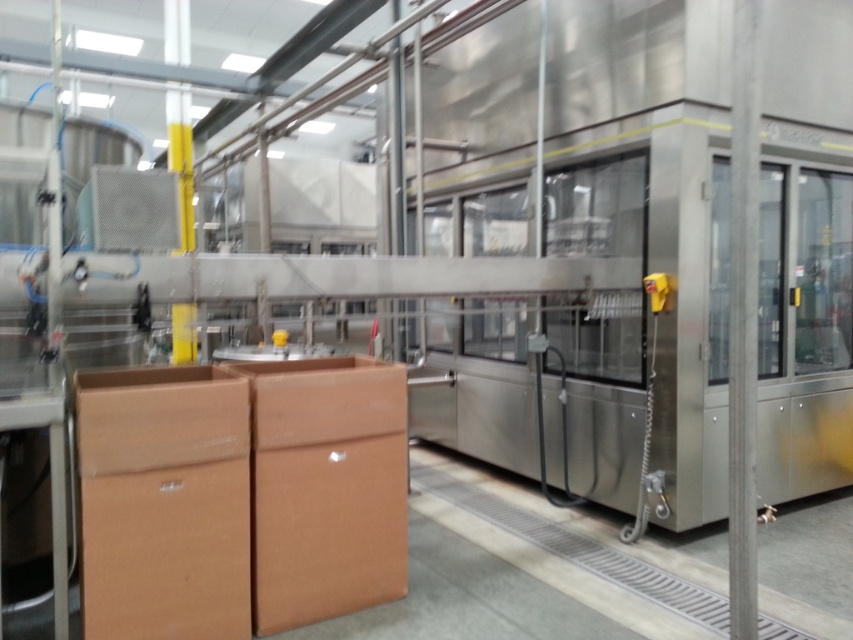
Question: Does brown cardboard box at left appear over metallic silver sink at center?

Choices:
 (A) yes
 (B) no

Answer: (B)

Question: Is the position of brown cardboard box at left less distant than that of metallic silver sink at center?

Choices:
 (A) no
 (B) yes

Answer: (B)

Question: Is brown cardboard box at left below metallic silver sink at center?

Choices:
 (A) yes
 (B) no

Answer: (A)